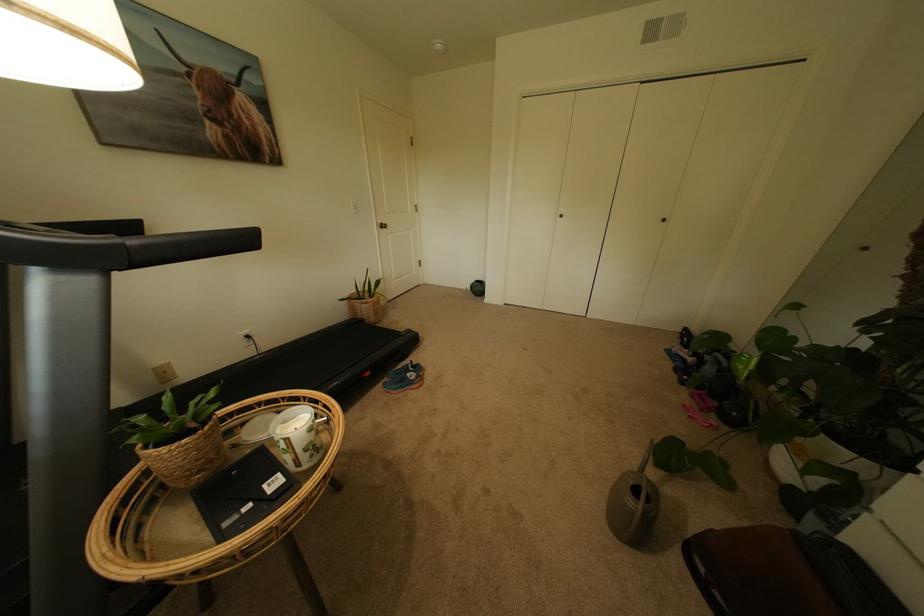
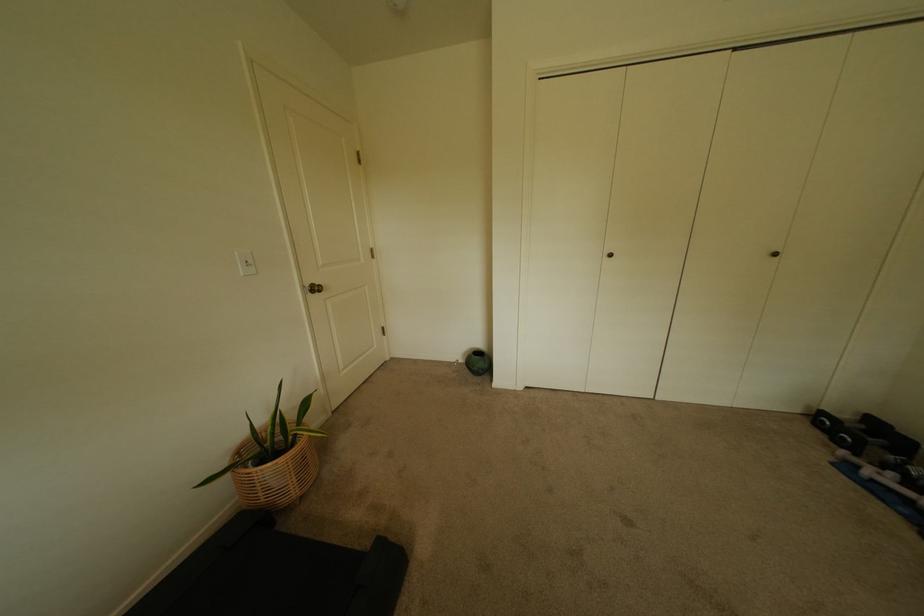
Where in the second image is the point corresponding to the point at 480,294 from the first image?

(476, 371)